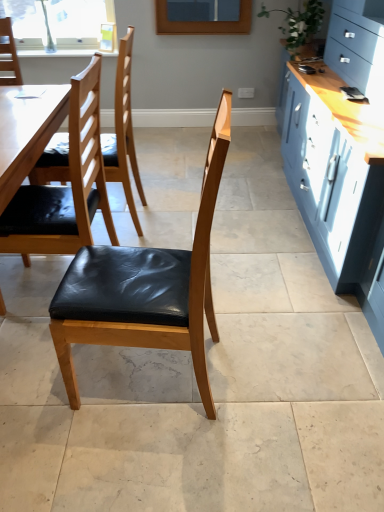
Question: Is green leafy plant at upper right positioned far away from clear glass window at upper left?

Choices:
 (A) yes
 (B) no

Answer: (A)

Question: From the image's perspective, would you say green leafy plant at upper right is shown under clear glass window at upper left?

Choices:
 (A) yes
 (B) no

Answer: (A)

Question: Is green leafy plant at upper right in front of clear glass window at upper left?

Choices:
 (A) yes
 (B) no

Answer: (A)

Question: From a real-world perspective, does green leafy plant at upper right stand above clear glass window at upper left?

Choices:
 (A) no
 (B) yes

Answer: (A)

Question: Is green leafy plant at upper right next to clear glass window at upper left and touching it?

Choices:
 (A) no
 (B) yes

Answer: (A)

Question: Considering the positions of clear glass window at upper left and matte black leather chair at center, the 1th chair from the front, in the image, is clear glass window at upper left taller or shorter than matte black leather chair at center, the 1th chair from the front,?

Choices:
 (A) short
 (B) tall

Answer: (A)

Question: In the image, is clear glass window at upper left positioned in front of or behind matte black leather chair at center, positioned as the 3th chair in back-to-front order?

Choices:
 (A) front
 (B) behind

Answer: (B)

Question: From a real-world perspective, is clear glass window at upper left positioned above or below matte black leather chair at center, the 1th chair from the front?

Choices:
 (A) above
 (B) below

Answer: (A)

Question: Looking at their shapes, would you say clear glass window at upper left is wider or thinner than matte black leather chair at center, positioned as the 3th chair in back-to-front order?

Choices:
 (A) thin
 (B) wide

Answer: (A)

Question: In the image, is black leather chair at left, the first chair from the back, positioned in front of or behind black leather chair at left, the 2th chair viewed from the back?

Choices:
 (A) front
 (B) behind

Answer: (B)

Question: Would you say black leather chair at left, positioned as the 3th chair in front-to-back order, is to the left or to the right of black leather chair at left, the 2th chair viewed from the back, in the picture?

Choices:
 (A) left
 (B) right

Answer: (B)

Question: From their relative heights in the image, would you say black leather chair at left, the first chair from the back, is taller or shorter than black leather chair at left, positioned as the second chair in front-to-back order?

Choices:
 (A) tall
 (B) short

Answer: (A)

Question: Does point 132,205 appear closer or farther from the camera than point 72,167?

Choices:
 (A) closer
 (B) farther

Answer: (B)

Question: Choose the correct answer: Is black leather chair at left, positioned as the second chair in front-to-back order, inside green leafy plant at upper right or outside it?

Choices:
 (A) outside
 (B) inside

Answer: (A)

Question: In terms of height, does black leather chair at left, positioned as the second chair in front-to-back order, look taller or shorter compared to green leafy plant at upper right?

Choices:
 (A) tall
 (B) short

Answer: (A)